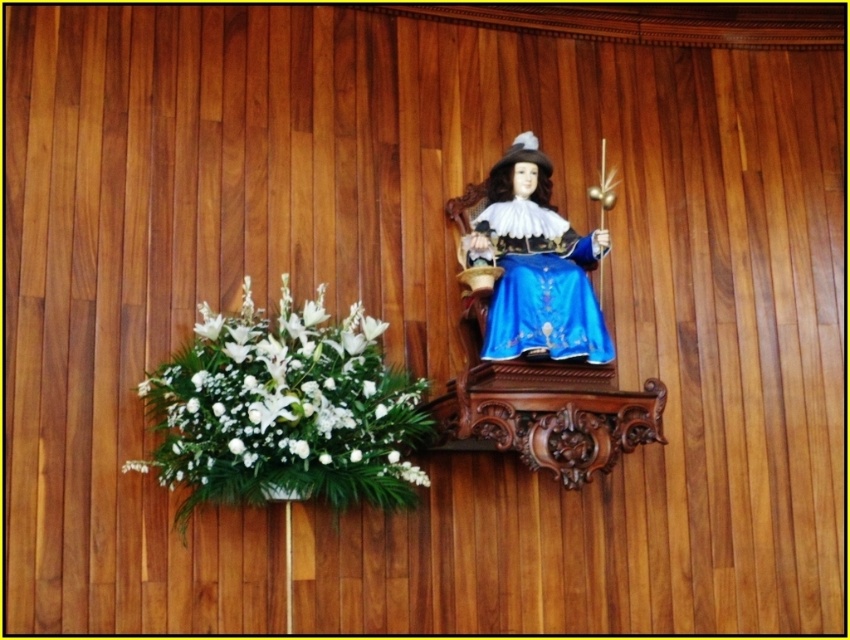
Question: Does white matte floral arrangement at lower left have a smaller size compared to blue satin dress at center?

Choices:
 (A) yes
 (B) no

Answer: (B)

Question: Is white matte floral arrangement at lower left closer to the viewer compared to blue satin dress at center?

Choices:
 (A) yes
 (B) no

Answer: (A)

Question: Is white matte floral arrangement at lower left thinner than blue satin dress at center?

Choices:
 (A) yes
 (B) no

Answer: (B)